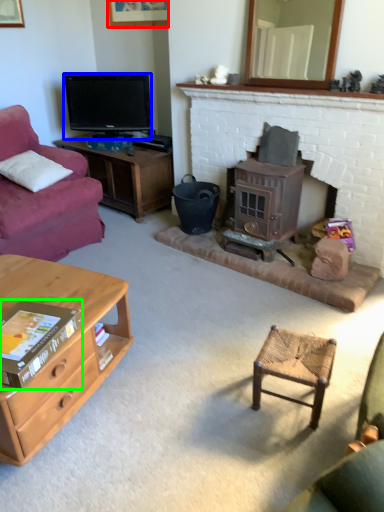
Question: Which object is the closest to the picture frame (highlighted by a red box)? Choose among these: television (highlighted by a blue box) or book (highlighted by a green box).

Choices:
 (A) television
 (B) book

Answer: (A)